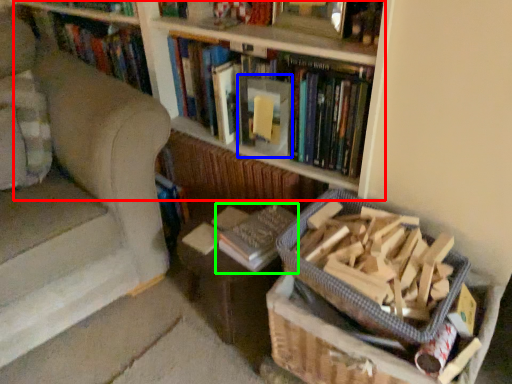
Question: Estimate the real-world distances between objects in this image. Which object is closer to bookcase (highlighted by a red box), paperback book (highlighted by a blue box) or book (highlighted by a green box)?

Choices:
 (A) paperback book
 (B) book

Answer: (A)